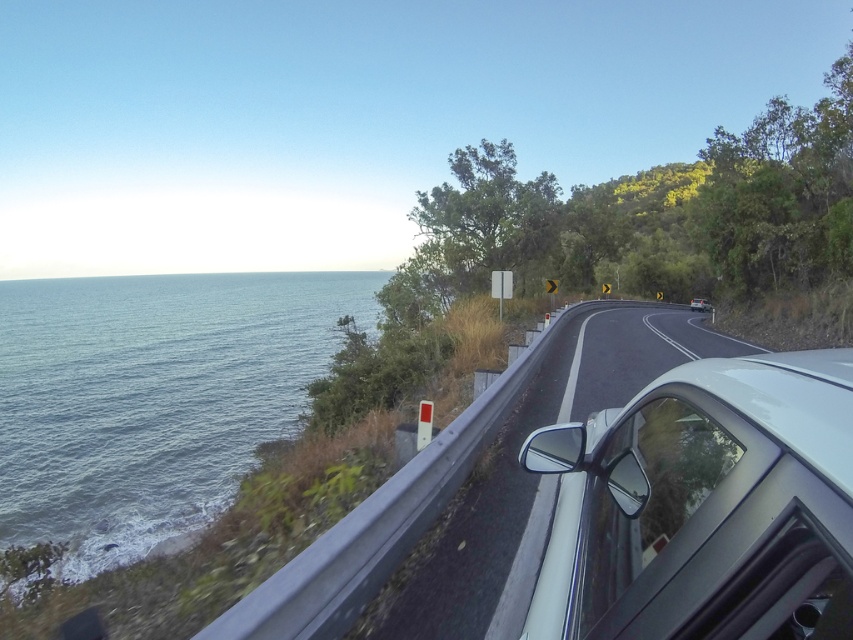
Question: Which object is positioned farthest from the blue water at left?

Choices:
 (A) white glossy car at right
 (B) metallic silver car at center
 (C) white glossy car at center-right

Answer: (C)

Question: Considering the relative positions of white glossy car at right and blue water at left in the image provided, where is white glossy car at right located with respect to blue water at left?

Choices:
 (A) below
 (B) above

Answer: (A)

Question: Which point is farther to the camera?

Choices:
 (A) (695, 307)
 (B) (12, 468)
 (C) (721, 532)
 (D) (502, 572)

Answer: (A)

Question: Can you confirm if white glossy car at right is smaller than metallic silver car at center?

Choices:
 (A) no
 (B) yes

Answer: (B)

Question: Considering the real-world distances, which object is closest to the white glossy car at center-right?

Choices:
 (A) blue water at left
 (B) metallic silver car at center
 (C) white glossy car at right

Answer: (B)

Question: Can you confirm if white glossy car at right is positioned above metallic silver car at center?

Choices:
 (A) no
 (B) yes

Answer: (B)